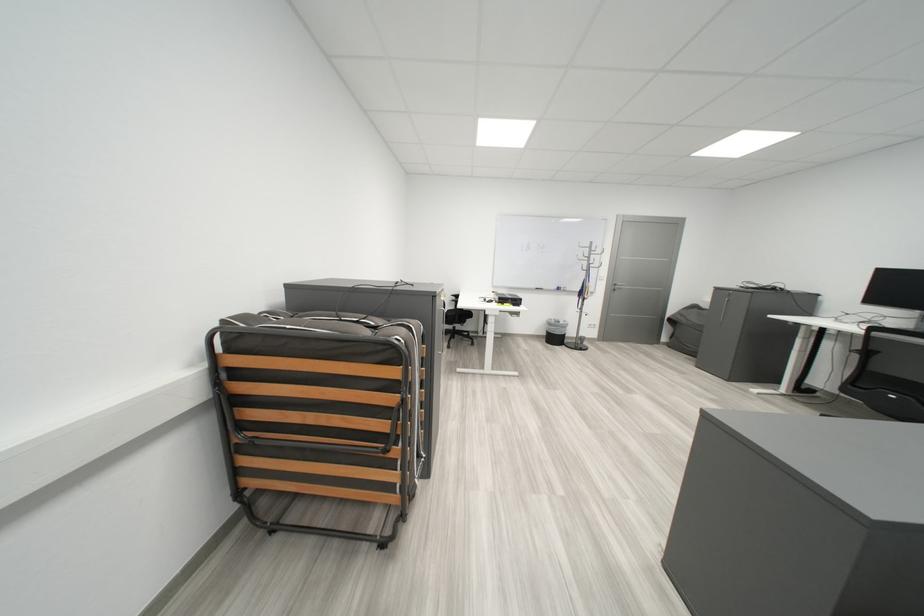
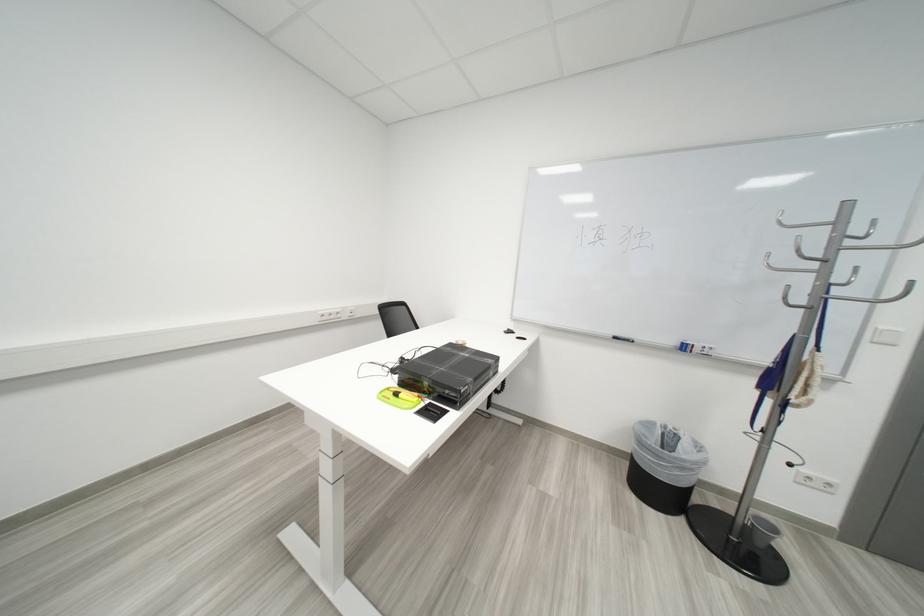
Locate, in the second image, the point that corresponds to pixel 603 253 in the first image.

(853, 238)